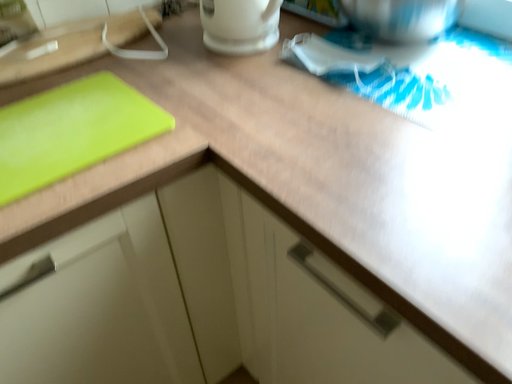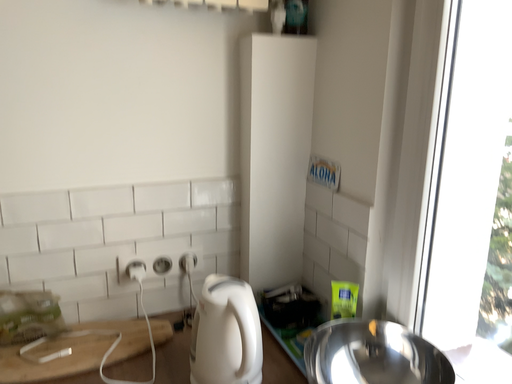
Question: Which way did the camera rotate in the video?

Choices:
 (A) rotated right
 (B) rotated left

Answer: (B)